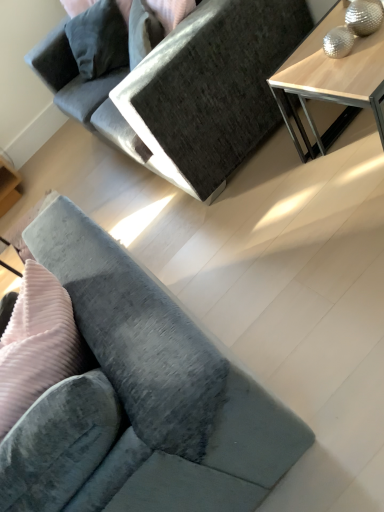
I want to click on free space to the left of light wood table at upper right, so click(307, 207).